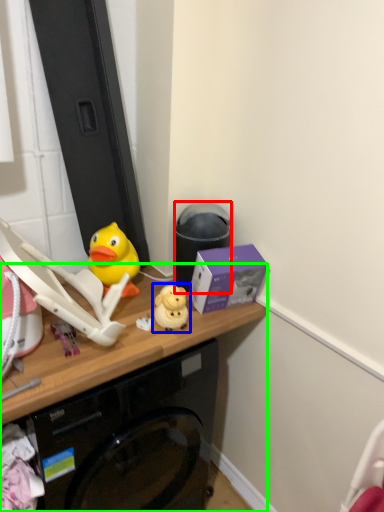
Question: Which is farther away from trash bin/can (highlighted by a red box)? toy (highlighted by a blue box) or desk (highlighted by a green box)?

Choices:
 (A) toy
 (B) desk

Answer: (B)